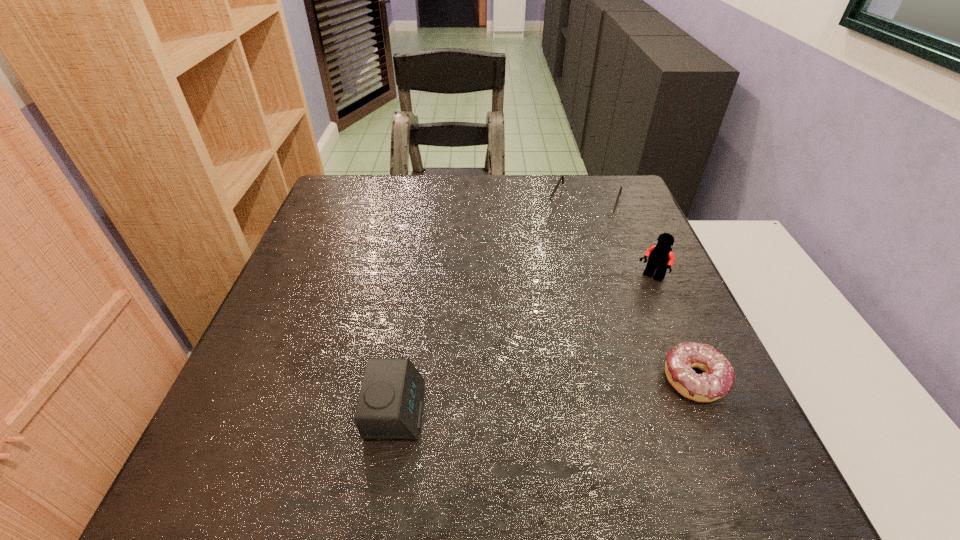
At what (x,y) coordinates should I click in order to perform the action: click on vacant point located between the doughnut and the alarm clock. Please return your answer as a coordinate pair (x, y). The height and width of the screenshot is (540, 960). Looking at the image, I should click on (545, 395).

Find the location of a particular element. This screenshot has width=960, height=540. blank region between the doughnut and the alarm clock is located at coordinates (545, 395).

Where is `vacant area between the doughnut and the spectacles`? The width and height of the screenshot is (960, 540). vacant area between the doughnut and the spectacles is located at coordinates (639, 293).

Locate an element on the screen. This screenshot has width=960, height=540. empty space that is in between the farthest object and the doughnut is located at coordinates (639, 293).

The image size is (960, 540). I want to click on vacant region between the leftmost object and the third nearest object, so click(x=523, y=345).

The height and width of the screenshot is (540, 960). I want to click on blank region between the spectacles and the doughnut, so click(x=639, y=293).

At what (x,y) coordinates should I click in order to perform the action: click on vacant point located between the Lego and the doughnut. Please return your answer as a coordinate pair (x, y). The height and width of the screenshot is (540, 960). Looking at the image, I should click on click(x=673, y=329).

This screenshot has height=540, width=960. Find the location of `vacant area between the doughnut and the second tallest object`. vacant area between the doughnut and the second tallest object is located at coordinates (545, 395).

Select which object appears as the second closest to the third nearest object. Please provide its 2D coordinates. Your answer should be formatted as a tuple, i.e. [(x, y)], where the tuple contains the x and y coordinates of a point satisfying the conditions above.

[(718, 379)]

You are a GUI agent. You are given a task and a screenshot of the screen. Output one action in this format:
    pyautogui.click(x=<x>, y=<y>)
    Task: Click on the object that is the second closest to the spectacles
    
    Given the screenshot: What is the action you would take?
    pyautogui.click(x=718, y=379)